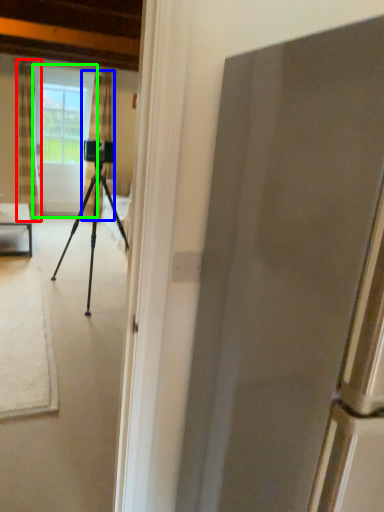
Question: Which object is positioned closest to curtain (highlighted by a red box)? Select from curtain (highlighted by a blue box) and screen door (highlighted by a green box).

Choices:
 (A) curtain
 (B) screen door

Answer: (B)